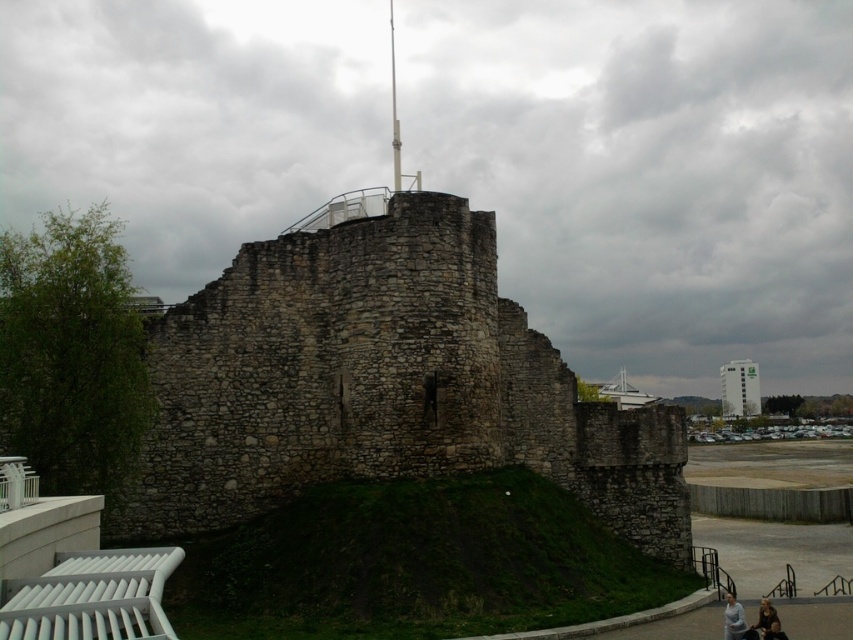
Question: Does green glass building at upper right have a greater width compared to light blue shirt at lower right?

Choices:
 (A) yes
 (B) no

Answer: (A)

Question: Which point is farther to the camera?

Choices:
 (A) (764, 612)
 (B) (750, 401)
 (C) (22, 586)

Answer: (B)

Question: Does light blue shirt at lower right come in front of golden hair at lower right?

Choices:
 (A) yes
 (B) no

Answer: (B)

Question: Is light blue shirt at lower right closer to the viewer compared to brown leather jacket at lower right?

Choices:
 (A) yes
 (B) no

Answer: (B)

Question: Estimate the real-world distances between objects in this image. Which object is closer to the brown leather jacket at lower right?

Choices:
 (A) golden hair at lower right
 (B) white plastic park bench at lower left
 (C) light blue shirt at lower right
 (D) green glass building at upper right

Answer: (A)

Question: Which point is closer to the camera?

Choices:
 (A) golden hair at lower right
 (B) light blue shirt at lower right

Answer: (A)